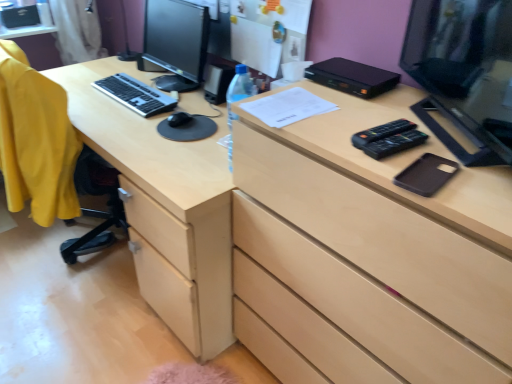
This screenshot has height=384, width=512. Find the location of `vacant space underneath black glossy monitor at upper right, the second computer monitor positioned from the back (from a real-world perspective)`. vacant space underneath black glossy monitor at upper right, the second computer monitor positioned from the back (from a real-world perspective) is located at coordinates (460, 135).